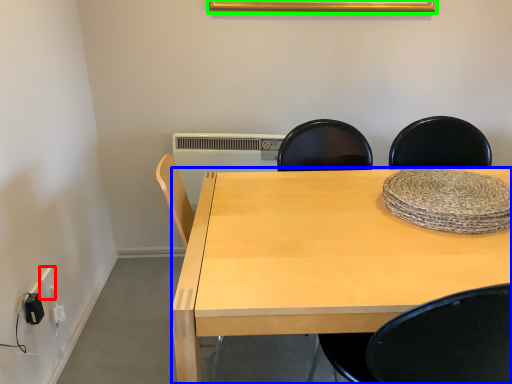
Question: Which object is the farthest from electric outlet (highlighted by a red box)? Choose among these: desk (highlighted by a blue box) or picture frame (highlighted by a green box).

Choices:
 (A) desk
 (B) picture frame

Answer: (B)